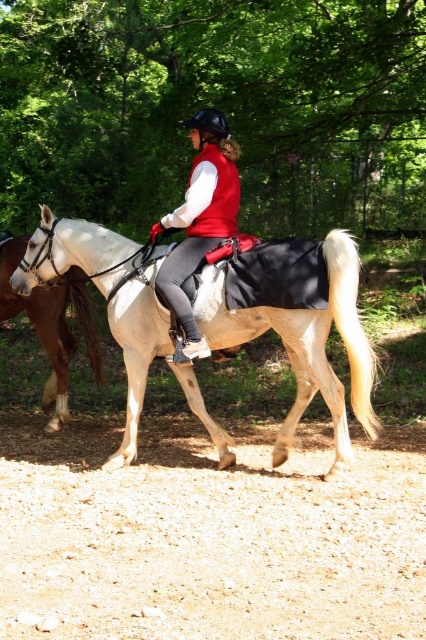
Question: Among these points, which one is farthest from the camera?

Choices:
 (A) (405, 435)
 (B) (250, 65)
 (C) (46, 339)

Answer: (B)

Question: Does matte red vest at center have a lesser width compared to brown glossy horse at left?

Choices:
 (A) yes
 (B) no

Answer: (A)

Question: In this image, where is brown gravel at lower center located relative to brown glossy horse at left?

Choices:
 (A) above
 (B) below

Answer: (B)

Question: From the image, what is the correct spatial relationship of light beige fabric horse at center in relation to matte red vest at center?

Choices:
 (A) below
 (B) above

Answer: (A)

Question: Which object appears closest to the camera in this image?

Choices:
 (A) green leafy tree at upper center
 (B) brown gravel at lower center

Answer: (B)

Question: Which point is closer to the camera taking this photo?

Choices:
 (A) (411, 38)
 (B) (198, 172)
 (C) (108, 500)

Answer: (C)